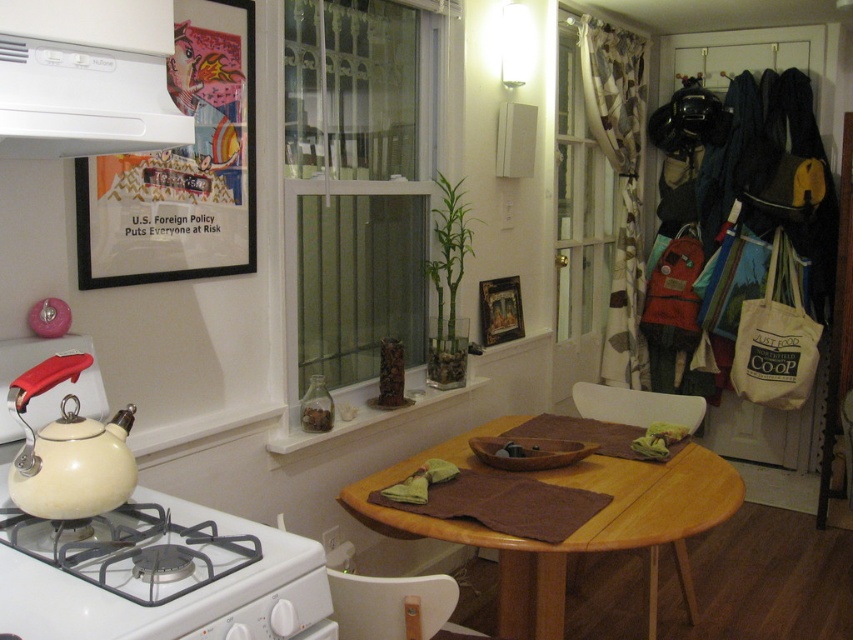
How much distance is there between matte black frame at upper left and cream matte teapot at stove front?

A distance of 62.26 centimeters exists between matte black frame at upper left and cream matte teapot at stove front.

Is matte black frame at upper left closer to camera compared to cream matte teapot at stove front?

That is False.

Describe the element at coordinates (181, 168) in the screenshot. I see `matte black frame at upper left` at that location.

Identify the location of matte black frame at upper left. The width and height of the screenshot is (853, 640). (181, 168).

Is white plastic exhaust hood at upper left smaller than cream matte teapot at stove front?

Incorrect, white plastic exhaust hood at upper left is not smaller in size than cream matte teapot at stove front.

Is white plastic exhaust hood at upper left thinner than cream matte teapot at stove front?

No.

The image size is (853, 640). I want to click on white plastic exhaust hood at upper left, so click(x=86, y=77).

Does cream matte teapot at stove front have a smaller size compared to transparent glass door at center?

Yes.

Can you confirm if cream matte teapot at stove front is positioned below transparent glass door at center?

Yes.

The image size is (853, 640). What are the coordinates of `cream matte teapot at stove front` in the screenshot? It's located at click(68, 449).